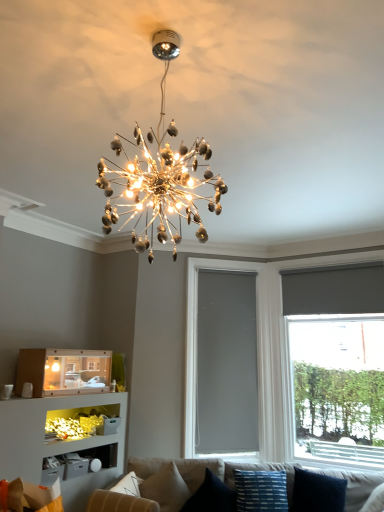
Question: Considering the relative sizes of matte gray roller shade at right and blue striped fabric pillow at lower center, the second pillow viewed from the right, in the image provided, is matte gray roller shade at right taller than blue striped fabric pillow at lower center, the second pillow viewed from the right,?

Choices:
 (A) yes
 (B) no

Answer: (A)

Question: Can we say matte gray roller shade at right lies outside blue striped fabric pillow at lower center, which is counted as the 3th pillow, starting from the left?

Choices:
 (A) no
 (B) yes

Answer: (B)

Question: From the image's perspective, is matte gray roller shade at right under blue striped fabric pillow at lower center, which is counted as the 3th pillow, starting from the left?

Choices:
 (A) no
 (B) yes

Answer: (A)

Question: From a real-world perspective, is matte gray roller shade at right physically below blue striped fabric pillow at lower center, which is counted as the 3th pillow, starting from the left?

Choices:
 (A) no
 (B) yes

Answer: (A)

Question: From the image's perspective, is matte gray roller shade at right on blue striped fabric pillow at lower center, which is counted as the 3th pillow, starting from the left?

Choices:
 (A) yes
 (B) no

Answer: (A)

Question: Is matte cardboard shelf at lower left situated inside blue striped fabric pillow at lower center, the second pillow viewed from the right, or outside?

Choices:
 (A) outside
 (B) inside

Answer: (A)

Question: Based on their sizes in the image, would you say matte cardboard shelf at lower left is bigger or smaller than blue striped fabric pillow at lower center, the second pillow viewed from the right?

Choices:
 (A) big
 (B) small

Answer: (A)

Question: In terms of width, does matte cardboard shelf at lower left look wider or thinner when compared to blue striped fabric pillow at lower center, the second pillow viewed from the right?

Choices:
 (A) wide
 (B) thin

Answer: (A)

Question: From a real-world perspective, relative to blue striped fabric pillow at lower center, which is counted as the 3th pillow, starting from the left, is matte cardboard shelf at lower left vertically above or below?

Choices:
 (A) above
 (B) below

Answer: (A)

Question: From a real-world perspective, is beige fabric pillow at lower center, the 4th pillow from the right, physically located above or below blue striped fabric pillow at lower center, which is counted as the 3th pillow, starting from the left?

Choices:
 (A) below
 (B) above

Answer: (A)

Question: Relative to blue striped fabric pillow at lower center, which is counted as the 3th pillow, starting from the left, is beige fabric pillow at lower center, the 4th pillow from the right, in front or behind?

Choices:
 (A) front
 (B) behind

Answer: (B)

Question: Is point (147, 489) closer or farther from the camera than point (251, 471)?

Choices:
 (A) closer
 (B) farther

Answer: (A)

Question: Considering the positions of beige fabric pillow at lower center, positioned as the first pillow in left-to-right order, and blue striped fabric pillow at lower center, which is counted as the 3th pillow, starting from the left, in the image, is beige fabric pillow at lower center, positioned as the first pillow in left-to-right order, wider or thinner than blue striped fabric pillow at lower center, which is counted as the 3th pillow, starting from the left,?

Choices:
 (A) wide
 (B) thin

Answer: (A)

Question: In the image, is shiny metallic chandelier at center positioned in front of or behind matte gray roller shade at right?

Choices:
 (A) front
 (B) behind

Answer: (A)

Question: Is shiny metallic chandelier at center inside the boundaries of matte gray roller shade at right, or outside?

Choices:
 (A) inside
 (B) outside

Answer: (B)